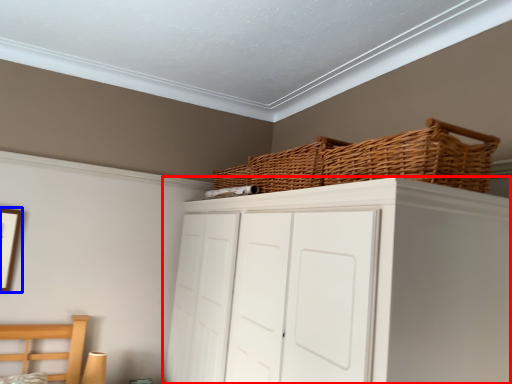
Question: Which of the following is the closest to the observer, cupboard (highlighted by a red box) or picture frame (highlighted by a blue box)?

Choices:
 (A) cupboard
 (B) picture frame

Answer: (A)